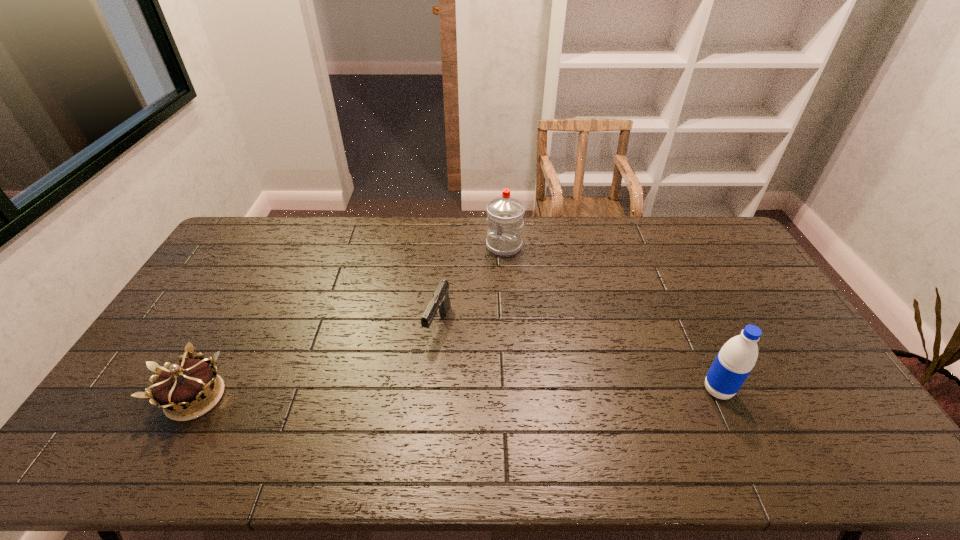
Identify the location of crown. The image size is (960, 540). (189, 384).

Locate an element on the screen. This screenshot has height=540, width=960. the rightmost object is located at coordinates (734, 362).

You are a GUI agent. You are given a task and a screenshot of the screen. Output one action in this format:
    pyautogui.click(x=<x>, y=<y>)
    Task: Click on the right water bottle
    The width and height of the screenshot is (960, 540).
    Given the screenshot: What is the action you would take?
    pyautogui.click(x=734, y=362)

Locate an element on the screen. This screenshot has width=960, height=540. pistol is located at coordinates (440, 302).

The image size is (960, 540). I want to click on the third object from right to left, so click(x=440, y=302).

In order to click on the third object from left to right in this screenshot , I will do `click(505, 214)`.

Identify the location of the farthest object. (505, 214).

At what (x,y) coordinates should I click in order to perform the action: click on vacant space located 0.050m on the back of the leftmost object. Please return your answer as a coordinate pair (x, y). Looking at the image, I should click on (220, 352).

Locate an element on the screen. This screenshot has height=540, width=960. free region located on the right of the right water bottle is located at coordinates (756, 390).

This screenshot has width=960, height=540. Find the location of `free spot located 0.220m aim along the barrel of the third object from right to left`. free spot located 0.220m aim along the barrel of the third object from right to left is located at coordinates (403, 413).